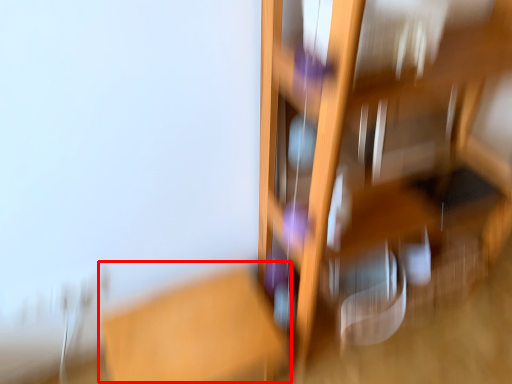
Question: From the image's perspective, what is the correct spatial positioning of table (annotated by the red box) in reference to furniture?

Choices:
 (A) above
 (B) below

Answer: (B)